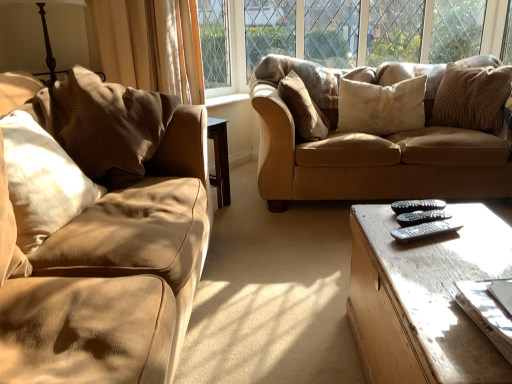
Where is `vacant space that is to the left of black plastic remote at center, which is counted as the 3th remote, starting from the back`? The image size is (512, 384). vacant space that is to the left of black plastic remote at center, which is counted as the 3th remote, starting from the back is located at coordinates (382, 233).